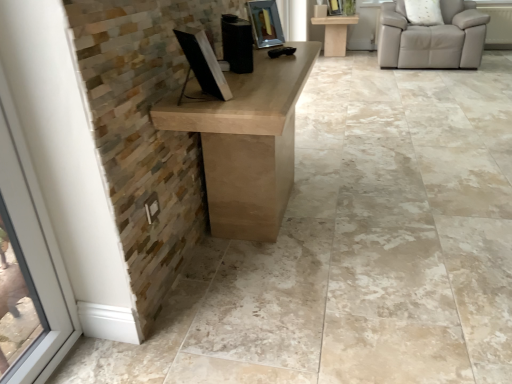
At what (x,y) coordinates should I click in order to perform the action: click on vacant point above metallic reflective picture frame at upper center, which is counted as the 1th picture frame, starting from the front (from a real-world perspective). Please return your answer as a coordinate pair (x, y). The image size is (512, 384). Looking at the image, I should click on (259, 1).